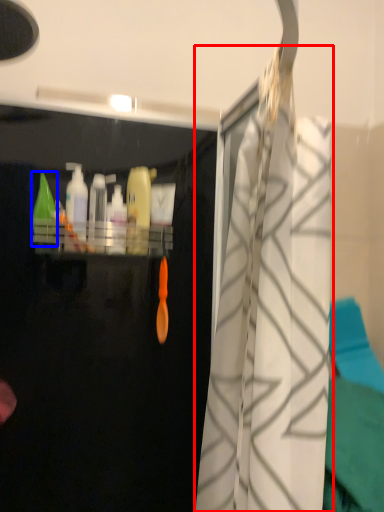
Question: Among these objects, which one is nearest to the camera, curtain (highlighted by a red box) or cleaning product (highlighted by a blue box)?

Choices:
 (A) curtain
 (B) cleaning product

Answer: (A)